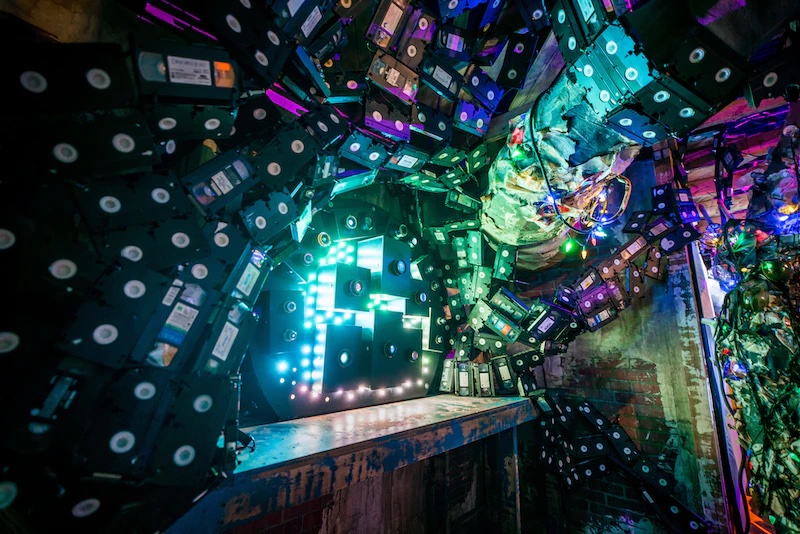
This screenshot has height=534, width=800. What are the coordinates of `under the counter top` in the screenshot? It's located at (374, 500).